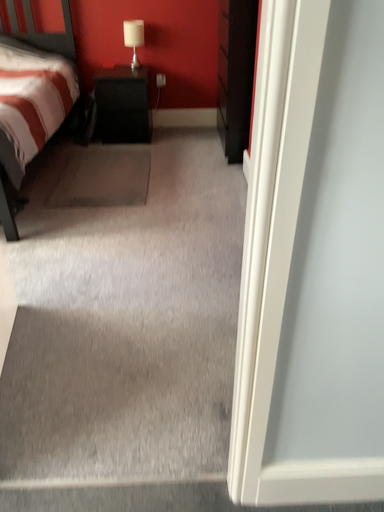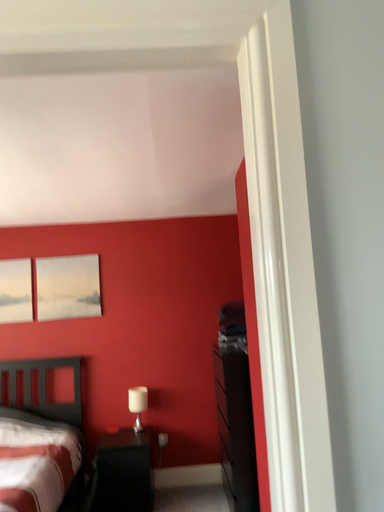
Question: Which way did the camera rotate in the video?

Choices:
 (A) rotated upward
 (B) rotated downward

Answer: (A)